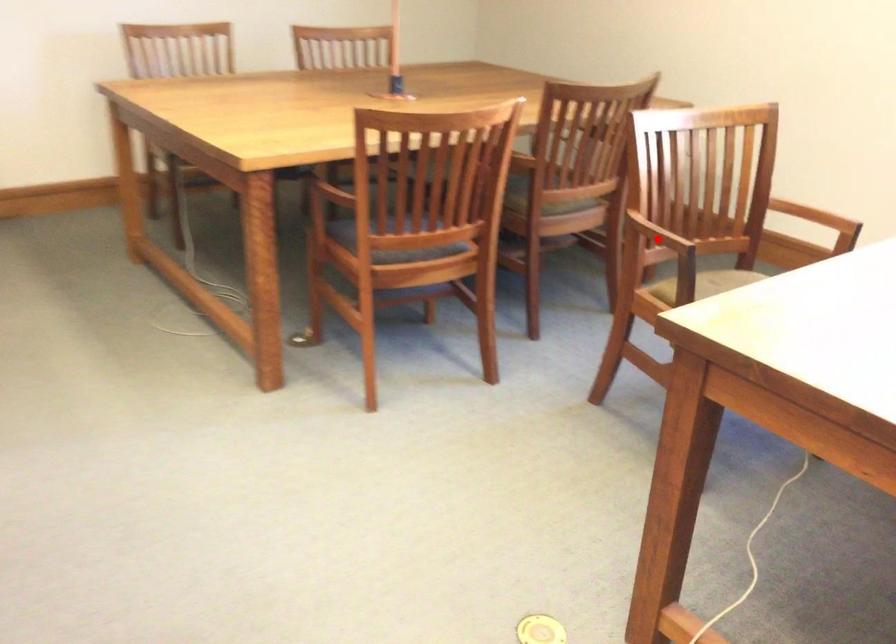
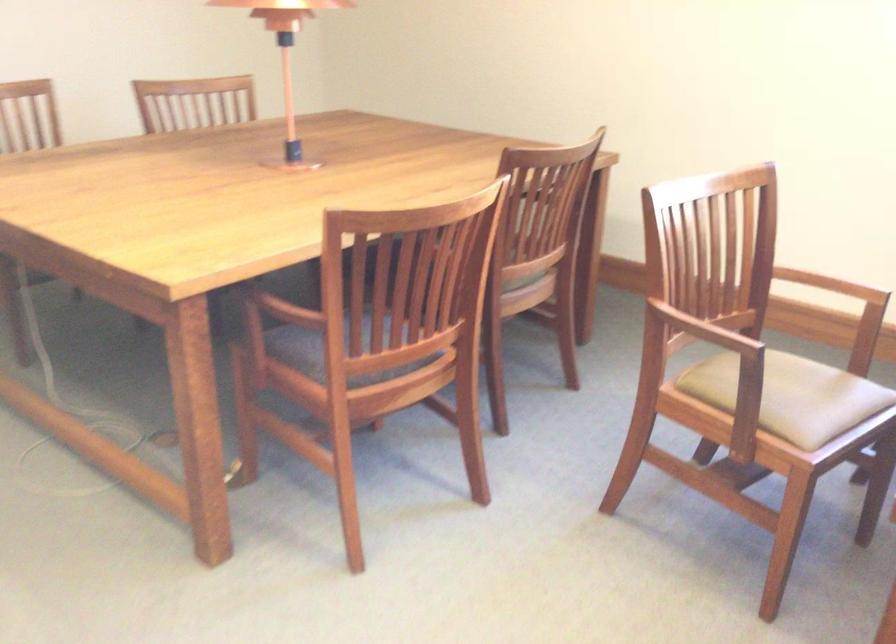
Question: I am providing you with two images of the same scene from different viewpoints. Given a red point in image1, look at the same physical point in image2. Is it:

Choices:
 (A) Closer to the viewpoint
 (B) Farther from the viewpoint

Answer: (A)